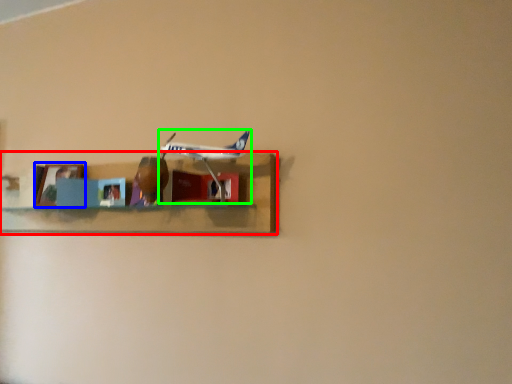
Question: Considering the real-world distances, which object is farthest from shelf (highlighted by a red box)? picture frame (highlighted by a blue box) or airplane (highlighted by a green box)?

Choices:
 (A) picture frame
 (B) airplane

Answer: (A)